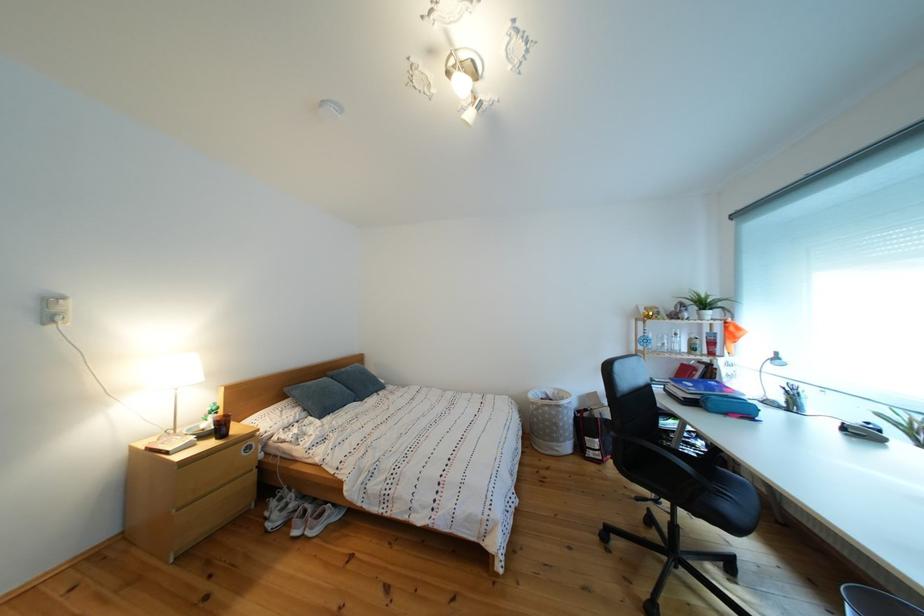
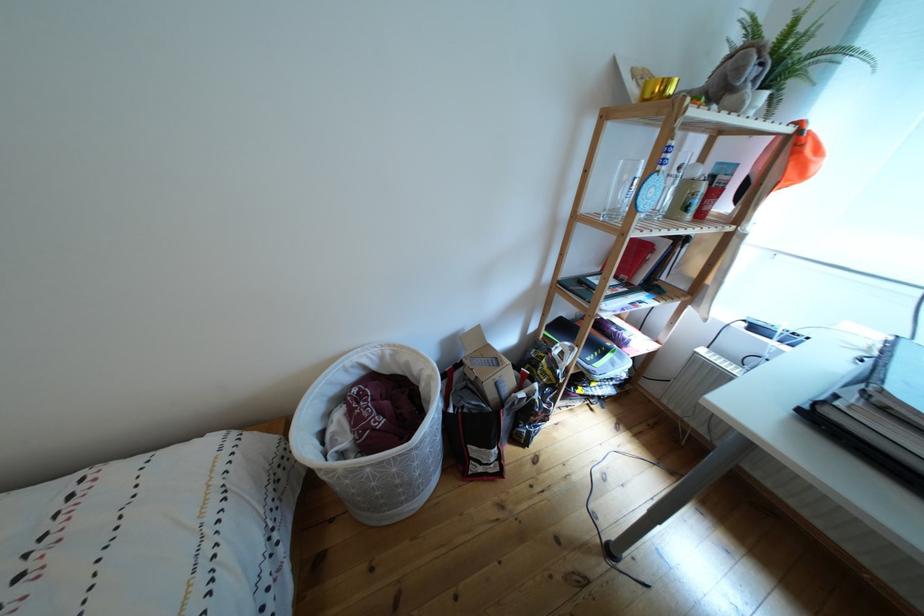
Locate, in the second image, the point that corresponds to point (565, 400) in the first image.

(393, 363)